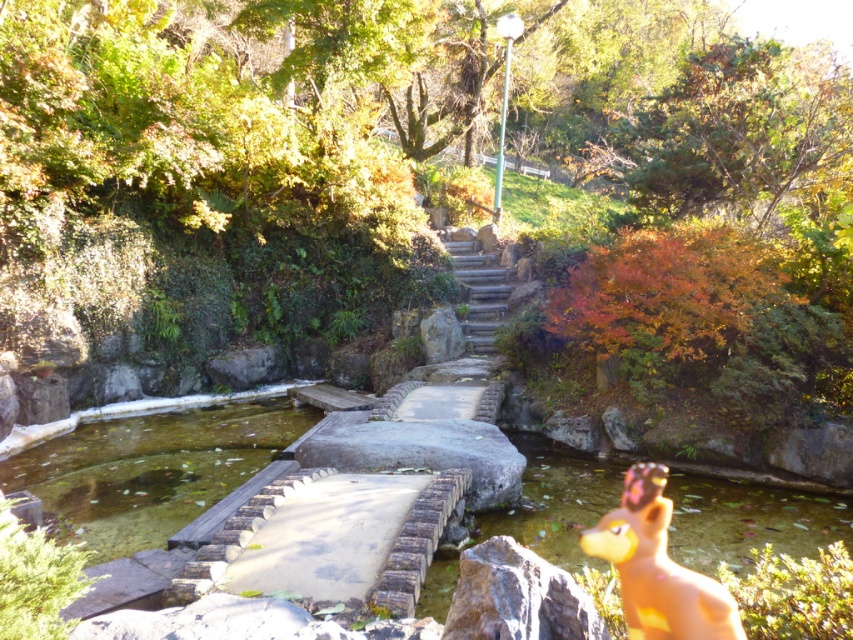
Question: Considering the real-world distances, which object is closest to the light brown plastic toy at lower right?

Choices:
 (A) stone steps at center
 (B) smooth gray rock at lower right

Answer: (B)

Question: Which point is farther to the camera?

Choices:
 (A) (587, 531)
 (B) (465, 275)

Answer: (B)

Question: Is smooth gray rock at lower right behind stone steps at center?

Choices:
 (A) yes
 (B) no

Answer: (B)

Question: Considering the relative positions of light brown plastic toy at lower right and smooth gray rock at lower right in the image provided, where is light brown plastic toy at lower right located with respect to smooth gray rock at lower right?

Choices:
 (A) below
 (B) above

Answer: (A)

Question: Considering the real-world distances, which object is closest to the light brown plastic toy at lower right?

Choices:
 (A) smooth gray rock at lower right
 (B) stone steps at center

Answer: (A)

Question: Is light brown plastic toy at lower right closer to the viewer compared to smooth gray rock at lower right?

Choices:
 (A) no
 (B) yes

Answer: (A)